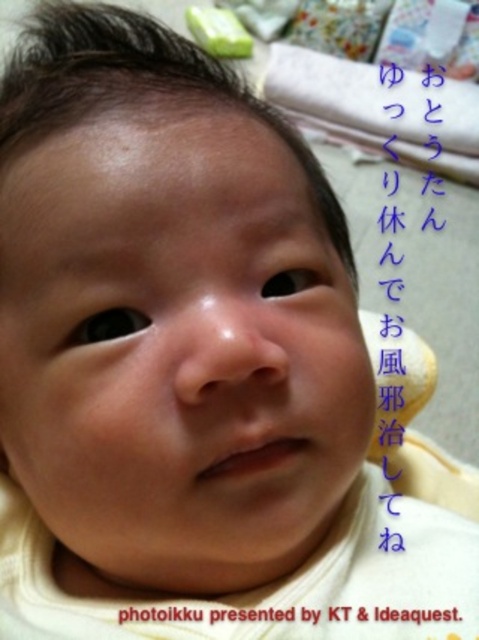
Question: Does blue paper at upper right appear over green rubber toy at upper center?

Choices:
 (A) no
 (B) yes

Answer: (A)

Question: Which is farther from the black paper at upper center?

Choices:
 (A) green rubber toy at upper center
 (B) blue paper at upper right

Answer: (A)

Question: Where is black paper at upper center located in relation to green rubber toy at upper center in the image?

Choices:
 (A) above
 (B) below

Answer: (B)

Question: Which point appears closest to the camera in this image?

Choices:
 (A) [175, 612]
 (B) [400, 403]

Answer: (A)

Question: Can you confirm if black paper at upper center is bigger than green rubber toy at upper center?

Choices:
 (A) no
 (B) yes

Answer: (A)

Question: Which object appears closest to the camera in this image?

Choices:
 (A) green rubber toy at upper center
 (B) blue paper at upper right

Answer: (B)